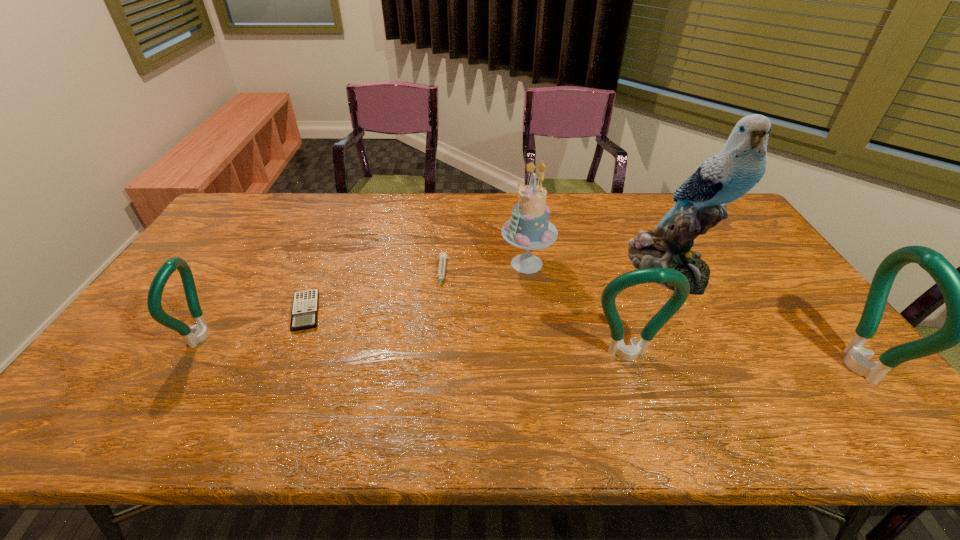
To achieve even spacing by inserting another bottle_opener among them, please point to a vacant spot for this new bottle_opener. Please provide its 2D coordinates. Your answer should be formatted as a tuple, i.e. [(x, y)], where the tuple contains the x and y coordinates of a point satisfying the conditions above.

[(411, 346)]